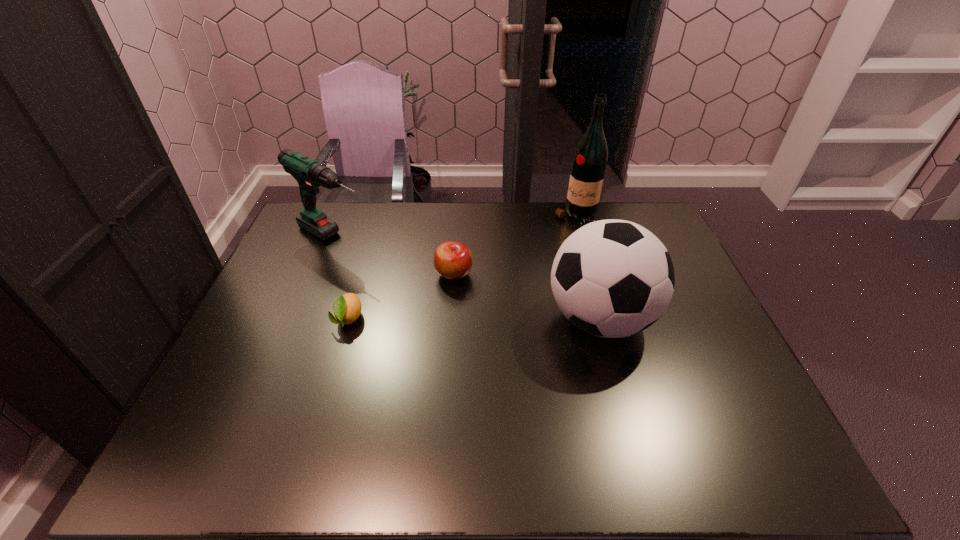
The image size is (960, 540). What are the coordinates of `vacant space located 0.220m on the surface of the wine bottle` in the screenshot? It's located at (537, 263).

At what (x,y) coordinates should I click in order to perform the action: click on vacant space located on the stem of the second shortest object. Please return your answer as a coordinate pair (x, y). The width and height of the screenshot is (960, 540). Looking at the image, I should click on (503, 330).

The image size is (960, 540). In order to click on free location located 0.210m on the stem of the second shortest object in this screenshot , I will do `click(503, 330)`.

Image resolution: width=960 pixels, height=540 pixels. In order to click on vacant space situated 0.190m on the stem of the second shortest object in this screenshot , I will do `click(499, 326)`.

Where is `free space located 0.160m on the handle side of the drill`? This screenshot has height=540, width=960. free space located 0.160m on the handle side of the drill is located at coordinates pyautogui.click(x=396, y=272).

Identify the location of free space located on the handle side of the drill. (396, 272).

At what (x,y) coordinates should I click in order to perform the action: click on free space located on the handle side of the drill. Please return your answer as a coordinate pair (x, y). The image size is (960, 540). Looking at the image, I should click on (376, 260).

The width and height of the screenshot is (960, 540). Find the location of `wine bottle at the far edge`. wine bottle at the far edge is located at coordinates (589, 162).

The width and height of the screenshot is (960, 540). Identify the location of drill that is at the far edge. (310, 175).

The width and height of the screenshot is (960, 540). Identify the location of object at the left edge. (310, 175).